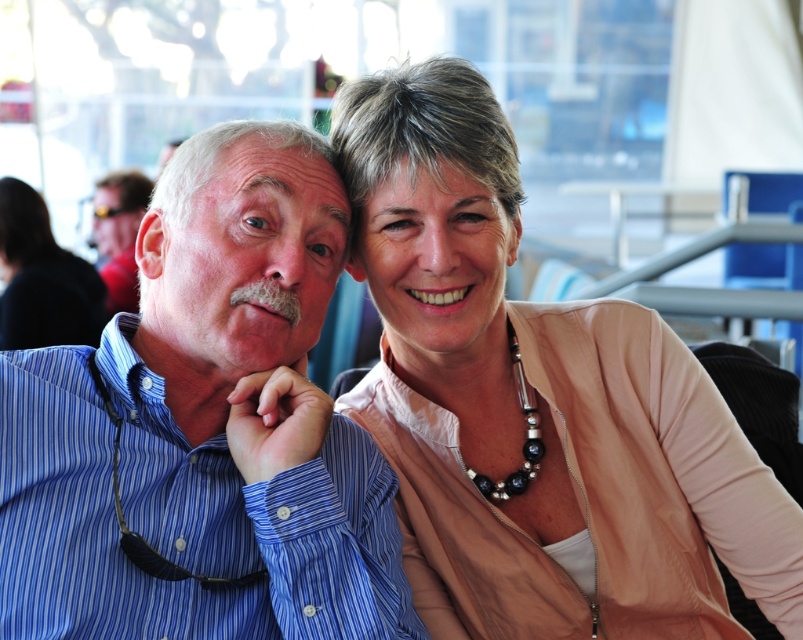
Question: Among these points, which one is nearest to the camera?

Choices:
 (A) (715, 458)
 (B) (398, 557)

Answer: (B)

Question: Which point is farther to the camera?

Choices:
 (A) (208, 220)
 (B) (367, 376)
 (C) (56, 273)

Answer: (C)

Question: Can you confirm if blue striped shirt at left is bigger than matte blue shirt at left?

Choices:
 (A) no
 (B) yes

Answer: (A)

Question: Which is farther from the matte blue shirt at left?

Choices:
 (A) matte beige sweater at upper right
 (B) pale beige sweater at center

Answer: (B)

Question: Is pale beige sweater at center positioned behind matte blue shirt at left?

Choices:
 (A) yes
 (B) no

Answer: (B)

Question: Is blue striped shirt at left positioned at the back of matte blue shirt at left?

Choices:
 (A) yes
 (B) no

Answer: (B)